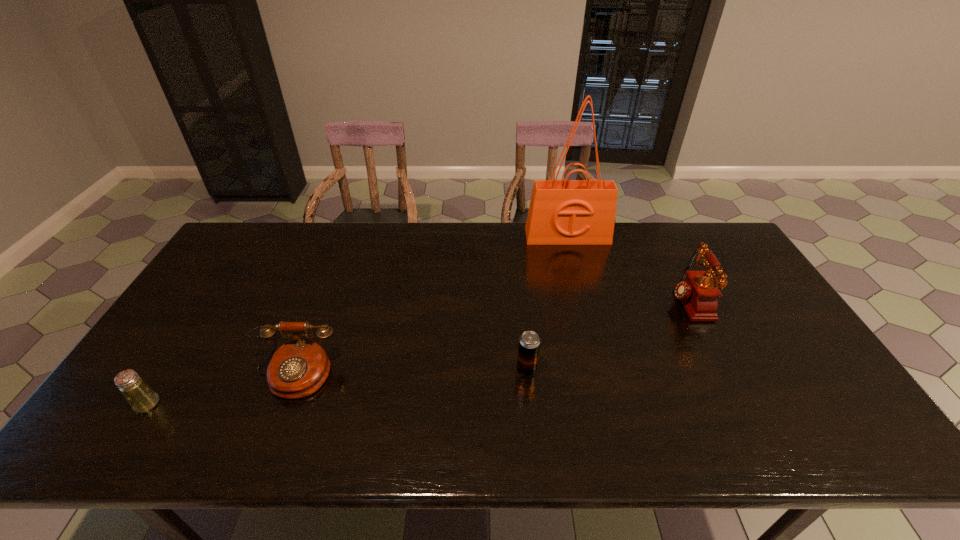
Where is `free space located on the dial of the right telephone`? The image size is (960, 540). free space located on the dial of the right telephone is located at coordinates (557, 300).

Find the location of a particular element. blank space located on the dial of the right telephone is located at coordinates (570, 300).

Where is `vacant space located 0.130m on the dial of the left telephone`? vacant space located 0.130m on the dial of the left telephone is located at coordinates (263, 451).

This screenshot has height=540, width=960. What are the coordinates of `vacant region located on the left of the third object from left to right` in the screenshot? It's located at (404, 370).

Where is `free location located on the right of the leftmost object`? This screenshot has height=540, width=960. free location located on the right of the leftmost object is located at coordinates (276, 404).

Image resolution: width=960 pixels, height=540 pixels. Find the location of `object located in the far edge section of the desktop`. object located in the far edge section of the desktop is located at coordinates (562, 212).

Where is `object that is at the left edge`? Image resolution: width=960 pixels, height=540 pixels. object that is at the left edge is located at coordinates (140, 396).

The image size is (960, 540). What are the coordinates of `vacant point at the far edge` in the screenshot? It's located at (370, 249).

This screenshot has width=960, height=540. In the image, there is a desktop. In order to click on vacant space at the near edge in this screenshot , I will do `click(263, 450)`.

Where is `vacant space at the far left corner of the desktop`? The height and width of the screenshot is (540, 960). vacant space at the far left corner of the desktop is located at coordinates (245, 255).